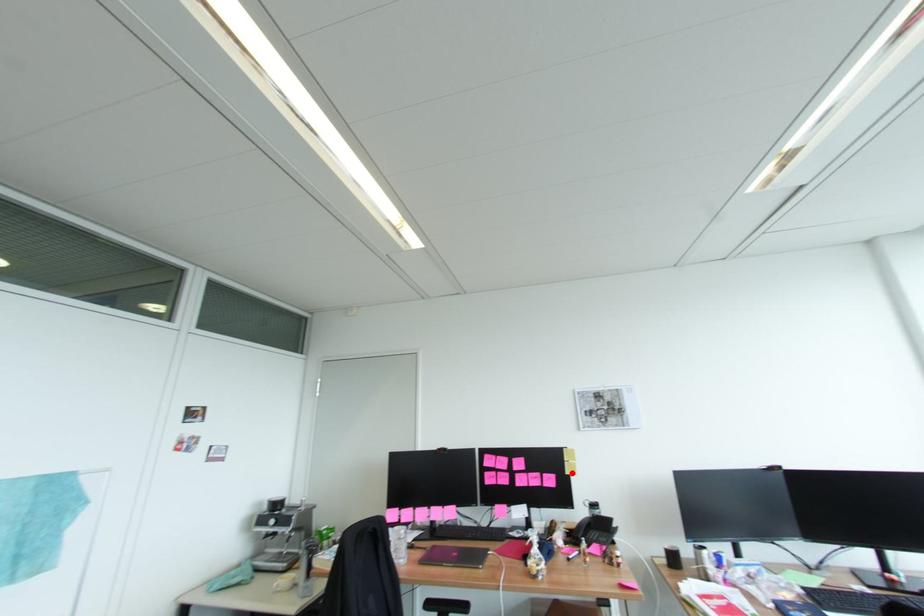
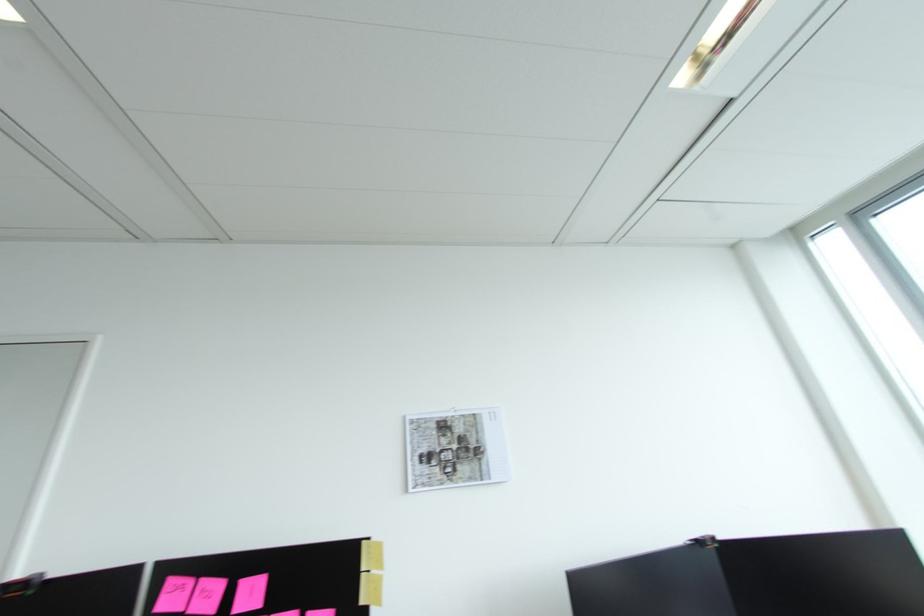
Find the pixel in the second image that matches the highlighted location in the first image.

(366, 602)